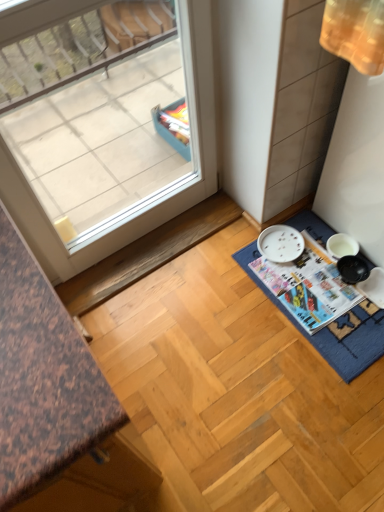
This screenshot has width=384, height=512. Identify the location of transparent glass window at upper left. (147, 202).

Measure the distance between point (293, 274) and camera.

They are 1.58 meters apart.

Where is `blue fabric bath mat at lower right`? blue fabric bath mat at lower right is located at coordinates (333, 331).

This screenshot has height=512, width=384. In order to click on transparent glass window at upper left in this screenshot , I will do `click(147, 202)`.

In terms of width, does transparent glass window at upper left look wider or thinner when compared to white glossy magazine at lower right?

Clearly, transparent glass window at upper left has less width compared to white glossy magazine at lower right.

Are transparent glass window at upper left and white glossy magazine at lower right making contact?

No, transparent glass window at upper left is not with white glossy magazine at lower right.

Is transparent glass window at upper left behind white glossy magazine at lower right?

No, transparent glass window at upper left is closer to the camera.

Is white glossy magazine at lower right located within transparent glass window at upper left?

No, white glossy magazine at lower right is not inside transparent glass window at upper left.

Between point (181, 191) and point (374, 315), which one is positioned in front?

The point (374, 315) is closer to the camera.

Is the depth of transparent glass window at upper left greater than that of blue fabric bath mat at lower right?

No, transparent glass window at upper left is closer to the viewer.

Is white glossy magazine at lower right turned away from blue fabric bath mat at lower right?

No.

Identify the location of bath mat on the right of white glossy magazine at lower right. (333, 331).

Does point (293, 271) lie behind point (352, 329)?

Yes, it is behind point (352, 329).

Is white glossy magazine at lower right positioned far away from transparent glass window at upper left?

No, there isn't a large distance between white glossy magazine at lower right and transparent glass window at upper left.

This screenshot has width=384, height=512. What are the coordinates of `magazine located on the right of transparent glass window at upper left` in the screenshot? It's located at (309, 286).

Does point (320, 320) appear closer or farther from the camera than point (186, 47)?

Point (320, 320) appears to be farther away from the viewer than point (186, 47).

From the image's perspective, which is below, blue fabric bath mat at lower right or white glossy magazine at lower right?

blue fabric bath mat at lower right.

Considering the relative positions of blue fabric bath mat at lower right and white glossy magazine at lower right in the image provided, is blue fabric bath mat at lower right behind white glossy magazine at lower right?

No, it is not.

Measure the distance from blue fabric bath mat at lower right to white glossy magazine at lower right.

blue fabric bath mat at lower right and white glossy magazine at lower right are 7.69 centimeters apart from each other.

Considering the points (359, 337) and (331, 278), which point is in front, point (359, 337) or point (331, 278)?

The point (359, 337) is in front.

Based on the photo, is blue fabric bath mat at lower right wider or thinner than transparent glass window at upper left?

Clearly, blue fabric bath mat at lower right has more width compared to transparent glass window at upper left.

Which is behind, point (322, 223) or point (178, 191)?

Positioned behind is point (322, 223).

Is blue fabric bath mat at lower right positioned with its back to transparent glass window at upper left?

No, blue fabric bath mat at lower right is not facing away from transparent glass window at upper left.

Does blue fabric bath mat at lower right appear on the right side of transparent glass window at upper left?

Yes.

Identify the location of window on the left of white glossy magazine at lower right. (147, 202).

Where is `bath mat on the right side of transparent glass window at upper left`? bath mat on the right side of transparent glass window at upper left is located at coordinates (333, 331).

Based on their spatial positions, is transparent glass window at upper left or blue fabric bath mat at lower right further from white glossy magazine at lower right?

The object further to white glossy magazine at lower right is transparent glass window at upper left.

Estimate the real-world distances between objects in this image. Which object is closer to white glossy magazine at lower right, blue fabric bath mat at lower right or transparent glass window at upper left?

Among the two, blue fabric bath mat at lower right is located nearer to white glossy magazine at lower right.

Estimate the real-world distances between objects in this image. Which object is closer to transparent glass window at upper left, blue fabric bath mat at lower right or white glossy magazine at lower right?

white glossy magazine at lower right.

Based on their spatial positions, is white glossy magazine at lower right or blue fabric bath mat at lower right further from transparent glass window at upper left?

Based on the image, blue fabric bath mat at lower right appears to be further to transparent glass window at upper left.

Based on their spatial positions, is transparent glass window at upper left or white glossy magazine at lower right further from blue fabric bath mat at lower right?

Based on the image, transparent glass window at upper left appears to be further to blue fabric bath mat at lower right.

When comparing their distances from blue fabric bath mat at lower right, does white glossy magazine at lower right or transparent glass window at upper left seem closer?

Among the two, white glossy magazine at lower right is located nearer to blue fabric bath mat at lower right.

At what (x,y) coordinates should I click in order to perform the action: click on magazine between transparent glass window at upper left and blue fabric bath mat at lower right. Please return your answer as a coordinate pair (x, y). Looking at the image, I should click on (309, 286).